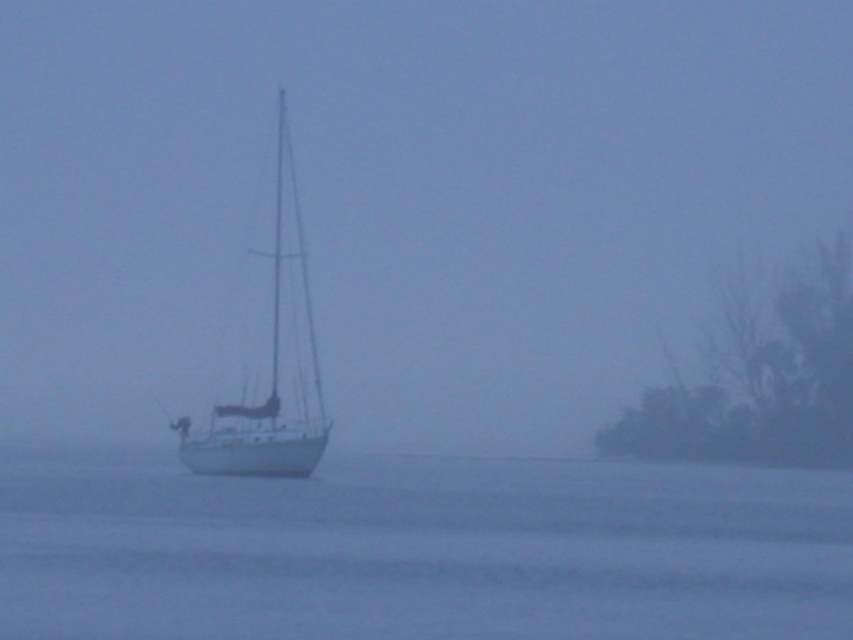
Question: Is foggy white sailboat at center below white water at center?

Choices:
 (A) no
 (B) yes

Answer: (A)

Question: Which point appears closest to the camera in this image?

Choices:
 (A) (648, 632)
 (B) (556, 136)
 (C) (271, 406)

Answer: (A)

Question: Which object is the closest to the white water at center?

Choices:
 (A) white matte sailboat at center
 (B) foggy white sailboat at center

Answer: (A)

Question: Can you confirm if foggy white sailboat at center is bigger than white matte sailboat at center?

Choices:
 (A) no
 (B) yes

Answer: (B)

Question: Does white water at center have a larger size compared to white matte sailboat at center?

Choices:
 (A) yes
 (B) no

Answer: (B)

Question: Which point is closer to the camera taking this photo?

Choices:
 (A) (189, 452)
 (B) (834, 36)

Answer: (A)